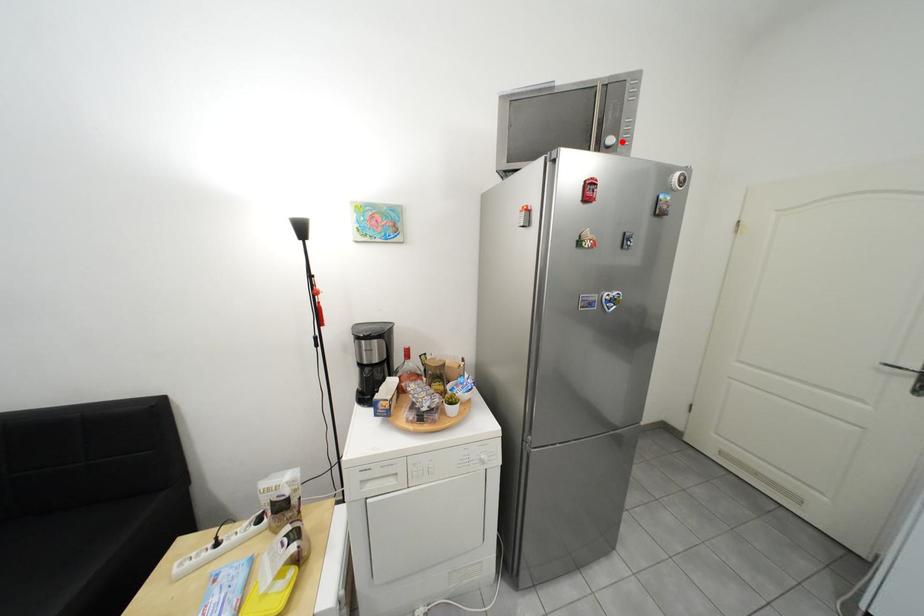
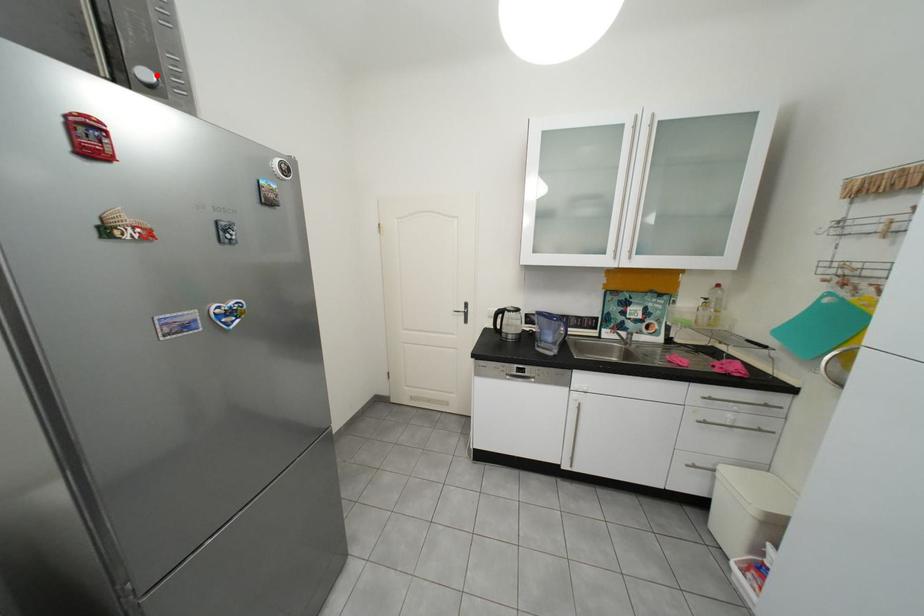
I am providing you with two images of the same scene from different viewpoints. A red point is marked on the first image and another point is marked on the second image. Are the points marked in image1 and image2 representing the same 3D position?

Yes